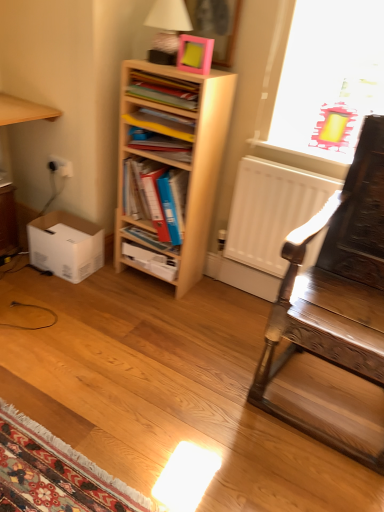
This screenshot has height=512, width=384. In order to click on free space in front of white cardboard box at lower left in this screenshot , I will do `click(57, 291)`.